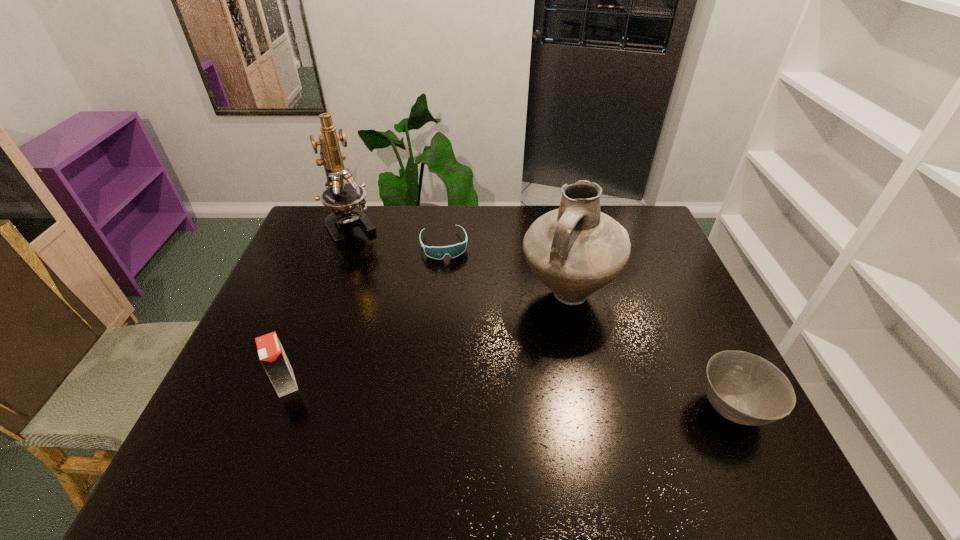
Where is `vacant region at the right edge`? The width and height of the screenshot is (960, 540). vacant region at the right edge is located at coordinates (660, 277).

Image resolution: width=960 pixels, height=540 pixels. I want to click on vacant space at the far left corner of the desktop, so coord(320,218).

The height and width of the screenshot is (540, 960). I want to click on free space at the far right corner of the desktop, so click(659, 229).

Find the location of a particular element. vacant space in between the bowl and the microscope is located at coordinates (542, 317).

The height and width of the screenshot is (540, 960). Find the location of `free spot between the microscope and the goggles`. free spot between the microscope and the goggles is located at coordinates (397, 235).

Where is `vacant point located between the goggles and the microscope`? vacant point located between the goggles and the microscope is located at coordinates (397, 235).

This screenshot has width=960, height=540. I want to click on free spot between the third tallest object and the second tallest object, so click(x=426, y=338).

You are a GUI agent. You are given a task and a screenshot of the screen. Output one action in this format:
    pyautogui.click(x=<x>, y=<y>)
    Task: Click on the free space between the goggles and the orange juice
    
    Given the screenshot: What is the action you would take?
    pyautogui.click(x=365, y=314)

Where is `free space between the microscope and the goggles`? The image size is (960, 540). free space between the microscope and the goggles is located at coordinates (397, 235).

This screenshot has width=960, height=540. What are the coordinates of `empty location between the rightmost object and the goggles` in the screenshot? It's located at (588, 327).